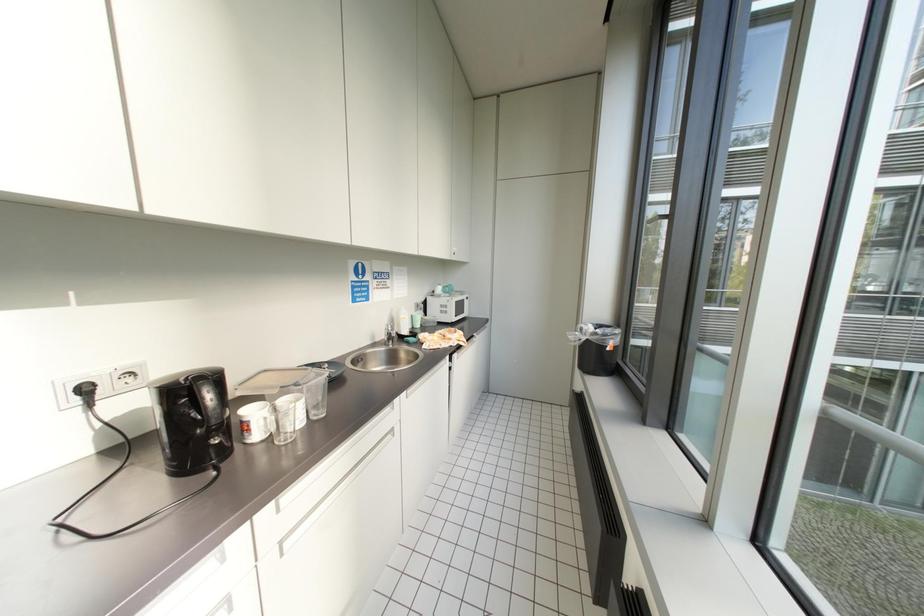
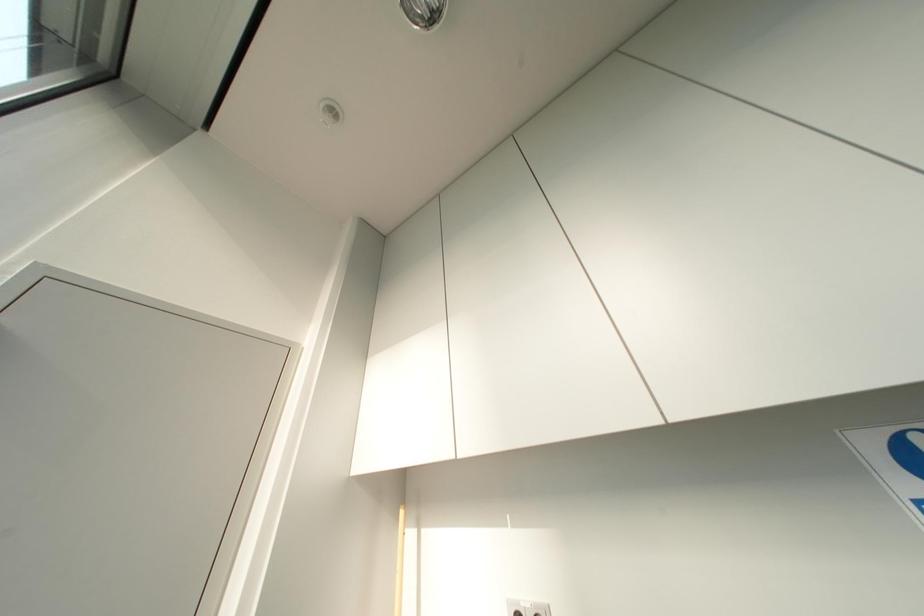
How did the camera likely rotate?

The camera's rotation is toward left-up.